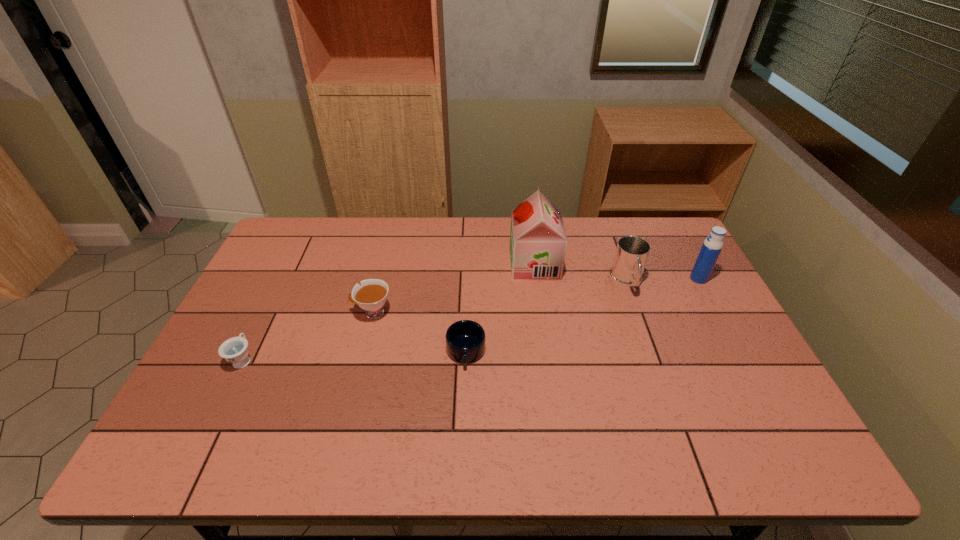
Find the location of a particular element. free spot at the right edge of the desktop is located at coordinates (718, 404).

Locate an element on the screen. This screenshot has height=540, width=960. vacant space at the far left corner of the desktop is located at coordinates (319, 245).

Where is `free region at the near left corner of the desktop`? free region at the near left corner of the desktop is located at coordinates (223, 449).

Find the location of `vacant space at the near right corner of the desktop`. vacant space at the near right corner of the desktop is located at coordinates (760, 460).

Image resolution: width=960 pixels, height=540 pixels. I want to click on free point between the fifth object from left to right and the farther teacup, so click(x=499, y=299).

The image size is (960, 540). Identify the location of free space between the right mug and the third object from left to right. (546, 318).

In order to click on unoccupied area between the nearer teacup and the fourth object from left to right in this screenshot , I will do `click(389, 312)`.

Identify the location of vacant space that is in between the fourth object from right to left and the nearer teacup. point(354,355).

Where is `free space between the rightmost object and the farther teacup`? Image resolution: width=960 pixels, height=540 pixels. free space between the rightmost object and the farther teacup is located at coordinates (536, 295).

The width and height of the screenshot is (960, 540). In order to click on vacant space that is in between the water bottle and the farther teacup in this screenshot , I will do `click(536, 295)`.